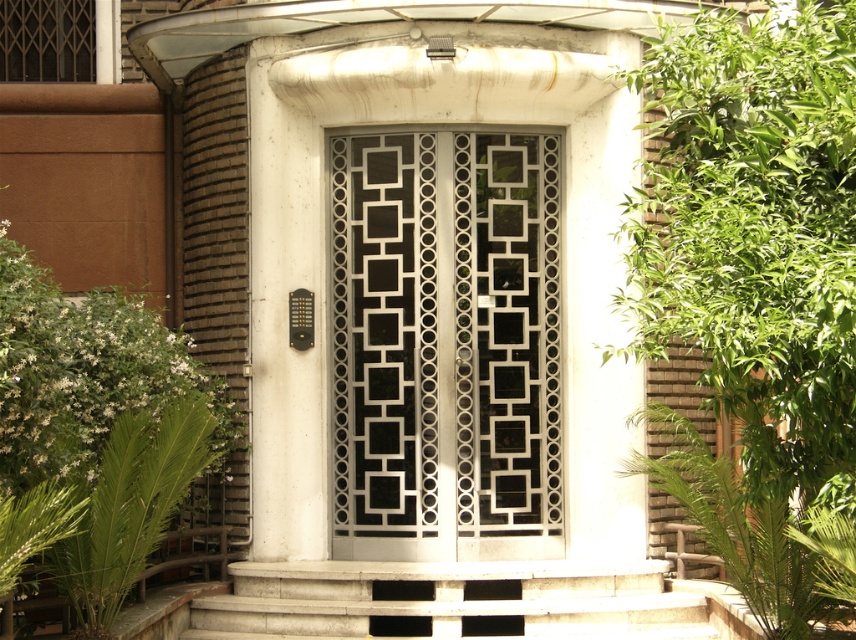
In the scene shown: Does green leafy plant at lower left appear on the right side of white concrete stairs at center?

Incorrect, green leafy plant at lower left is not on the right side of white concrete stairs at center.

Is green leafy plant at lower left bigger than white concrete stairs at center?

Yes, green leafy plant at lower left is bigger than white concrete stairs at center.

Find the location of `green leafy plant at lower left`. green leafy plant at lower left is located at coordinates (94, 432).

At what (x,y) coordinates should I click in order to perform the action: click on green leafy plant at lower left. Please return your answer as a coordinate pair (x, y). Looking at the image, I should click on (94, 432).

Who is taller, green leafy plant at right or white concrete stairs at center?

green leafy plant at right is taller.

Does green leafy plant at right have a larger size compared to white concrete stairs at center?

No, green leafy plant at right is not bigger than white concrete stairs at center.

What do you see at coordinates (755, 289) in the screenshot?
I see `green leafy plant at right` at bounding box center [755, 289].

Find the location of a particular element. Image resolution: width=856 pixels, height=640 pixels. green leafy plant at right is located at coordinates (755, 289).

Does point (828, 461) lie in front of point (498, 200)?

Yes.

I want to click on green leafy plant at right, so click(x=755, y=289).